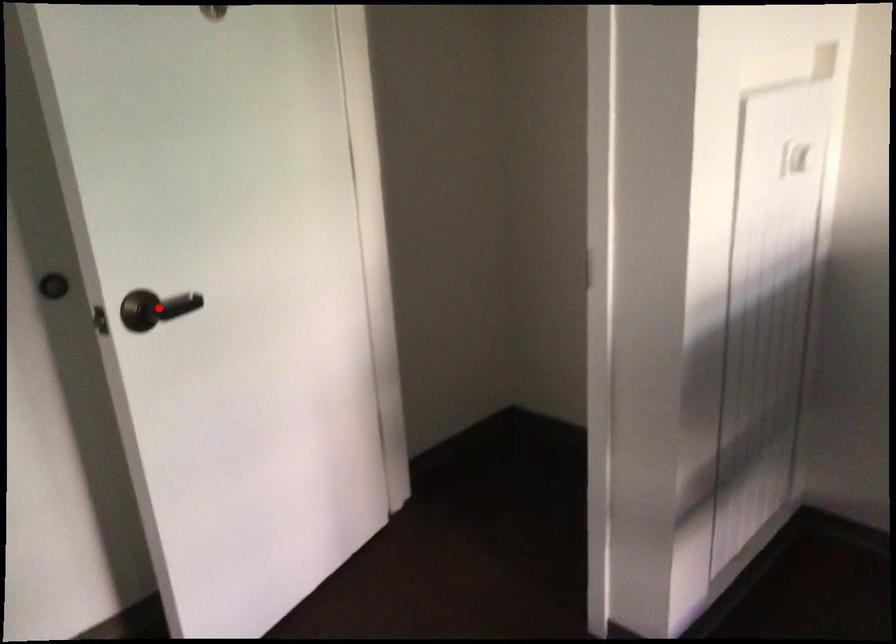
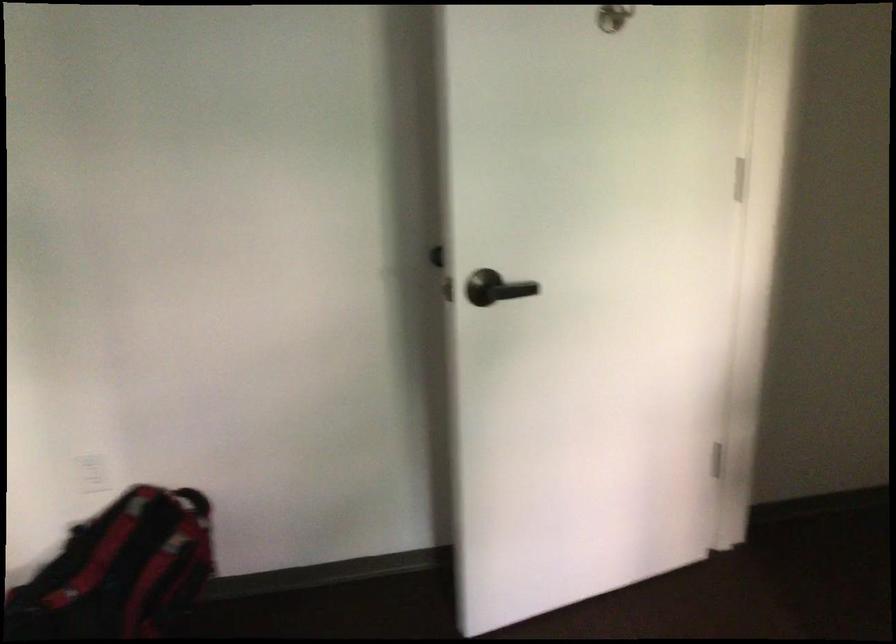
In the second image, find the point that corresponds to the highlighted location in the first image.

(495, 288)